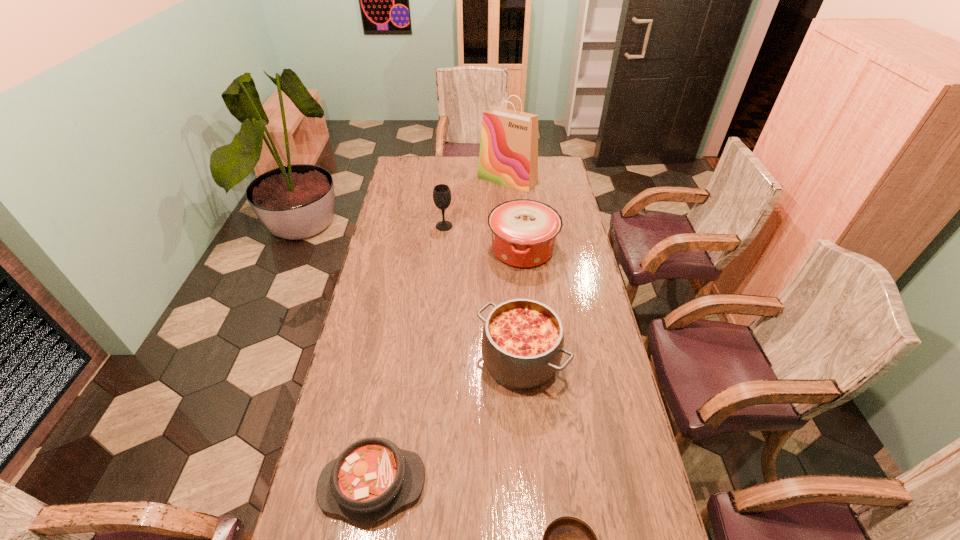
You are a GUI agent. You are given a task and a screenshot of the screen. Output one action in this format:
    pyautogui.click(x=<x>, y=<y>)
    Task: Click on the tallest object
    The image size is (960, 540).
    Given the screenshot: What is the action you would take?
    pyautogui.click(x=508, y=155)

What are the coordinates of `the farthest object` in the screenshot? It's located at (508, 155).

Where is `wineglass`? The height and width of the screenshot is (540, 960). wineglass is located at coordinates (441, 194).

The width and height of the screenshot is (960, 540). Identify the location of the farthest casserole. (524, 231).

The width and height of the screenshot is (960, 540). In order to click on the fourth farthest object in this screenshot , I will do `click(522, 344)`.

You are a GUI agent. You are given a task and a screenshot of the screen. Output one action in this format:
    pyautogui.click(x=<x>, y=<y>)
    Task: Click on the nearest casserole
    This screenshot has height=540, width=960.
    Given the screenshot: What is the action you would take?
    pyautogui.click(x=372, y=478)

Where is `the leftmost casserole`? This screenshot has width=960, height=540. the leftmost casserole is located at coordinates (372, 478).

In order to click on vacant area situated on the left of the shopping bag in this screenshot , I will do `click(413, 179)`.

Where is `vacant space located on the front of the wineglass`? Image resolution: width=960 pixels, height=540 pixels. vacant space located on the front of the wineglass is located at coordinates (439, 283).

Where is `free location located on the back of the farthest casserole`? This screenshot has width=960, height=540. free location located on the back of the farthest casserole is located at coordinates (517, 201).